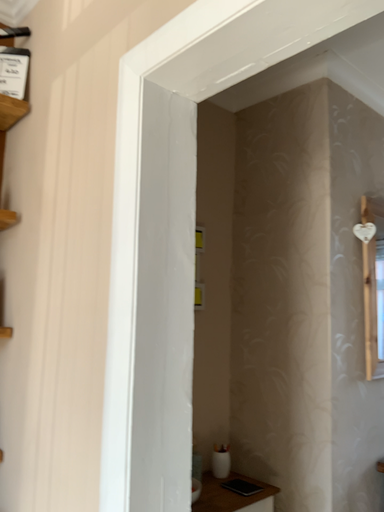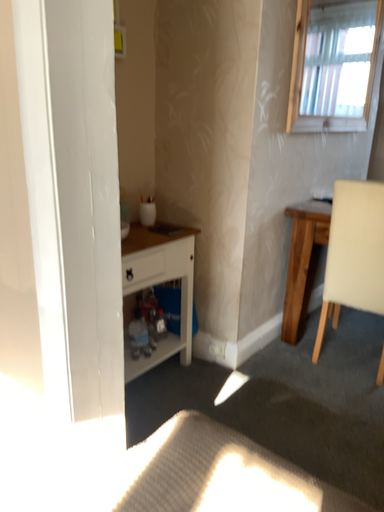
Question: How did the camera likely rotate when shooting the video?

Choices:
 (A) rotated right
 (B) rotated left

Answer: (A)